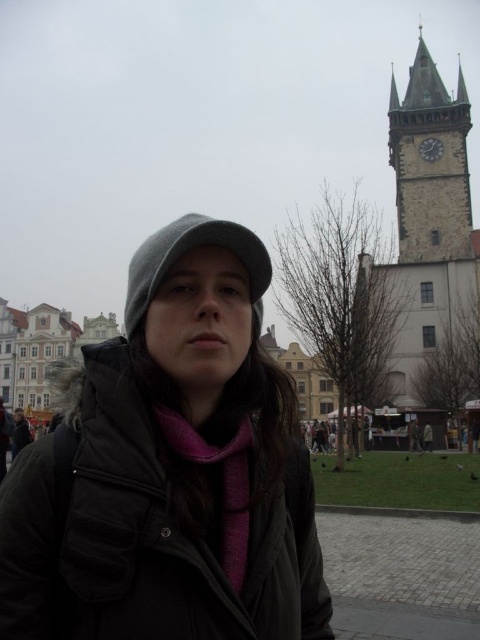
Question: Is matte gray beanie at center thinner than stone clock tower at upper right?

Choices:
 (A) no
 (B) yes

Answer: (A)

Question: Which object is positioned closest to the purple soft scarf at center?

Choices:
 (A) gray woolen hat at center
 (B) matte gray beanie at center
 (C) stone clock tower at upper right

Answer: (B)

Question: Considering the real-world distances, which object is farthest from the gray woolen hat at center?

Choices:
 (A) purple soft scarf at center
 (B) stone clock tower at upper right
 (C) matte gray beanie at center

Answer: (B)

Question: Estimate the real-world distances between objects in this image. Which object is closer to the stone clock tower at upper right?

Choices:
 (A) gray woolen hat at center
 (B) matte gray beanie at center
 (C) purple soft scarf at center

Answer: (A)

Question: Can you confirm if matte gray beanie at center is positioned below stone clock tower at upper right?

Choices:
 (A) no
 (B) yes

Answer: (B)

Question: Does matte gray beanie at center appear over gray woolen hat at center?

Choices:
 (A) yes
 (B) no

Answer: (B)